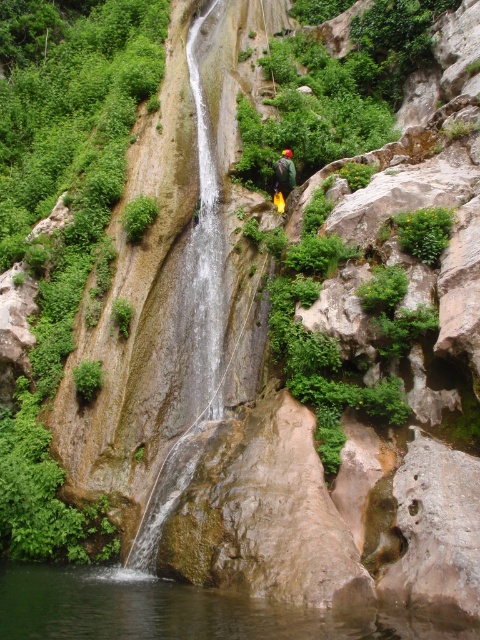
You are a hiker who just arrived at the waterfall. You see the clear water at center and the green fabric helmet at center. Which object is positioned to the left?

The clear water at center is to the left of the green fabric helmet at center.